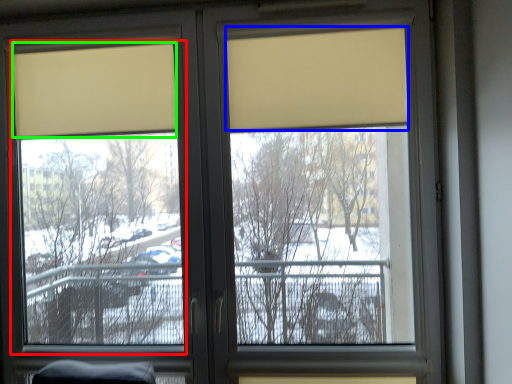
Question: Which is farther away from window screen (highlighted by a red box)? curtain (highlighted by a blue box) or curtain (highlighted by a green box)?

Choices:
 (A) curtain
 (B) curtain

Answer: (A)